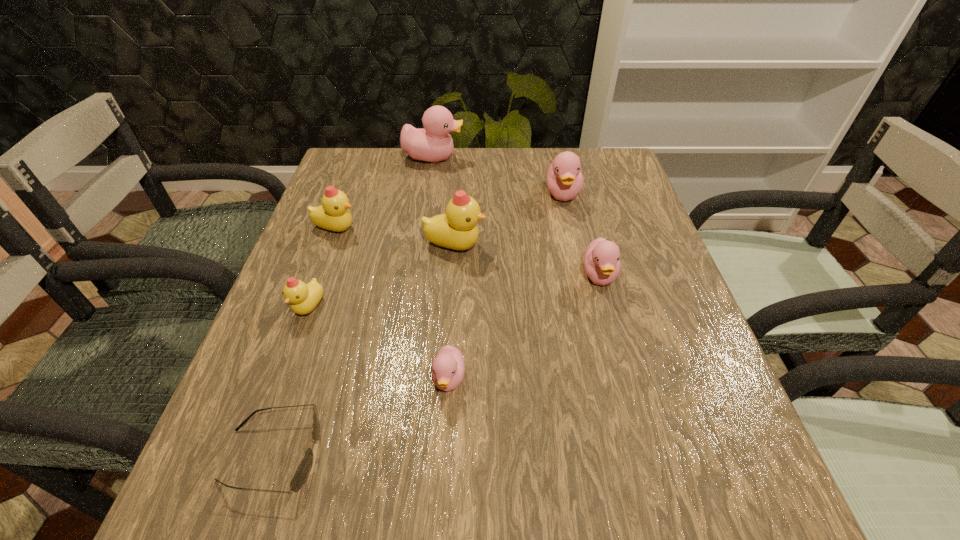
Where is `free spot that satisfies the following two spatial constraints: 1. on the front-facing side of the second nearest pink duckling; 2. on the front-facing side of the nearest object`? free spot that satisfies the following two spatial constraints: 1. on the front-facing side of the second nearest pink duckling; 2. on the front-facing side of the nearest object is located at coordinates tap(648, 455).